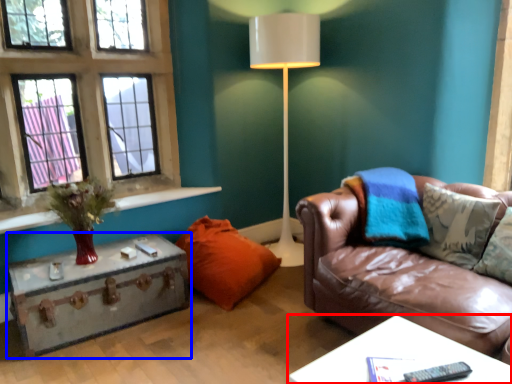
Question: Which of the following is the closest to the observer, table (highlighted by a red box) or table (highlighted by a blue box)?

Choices:
 (A) table
 (B) table

Answer: (A)